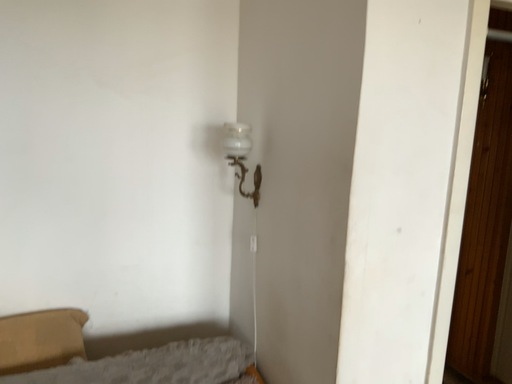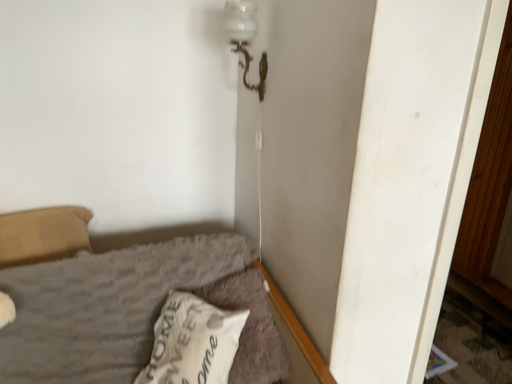
Question: Which way did the camera rotate in the video?

Choices:
 (A) rotated upward
 (B) rotated downward

Answer: (B)